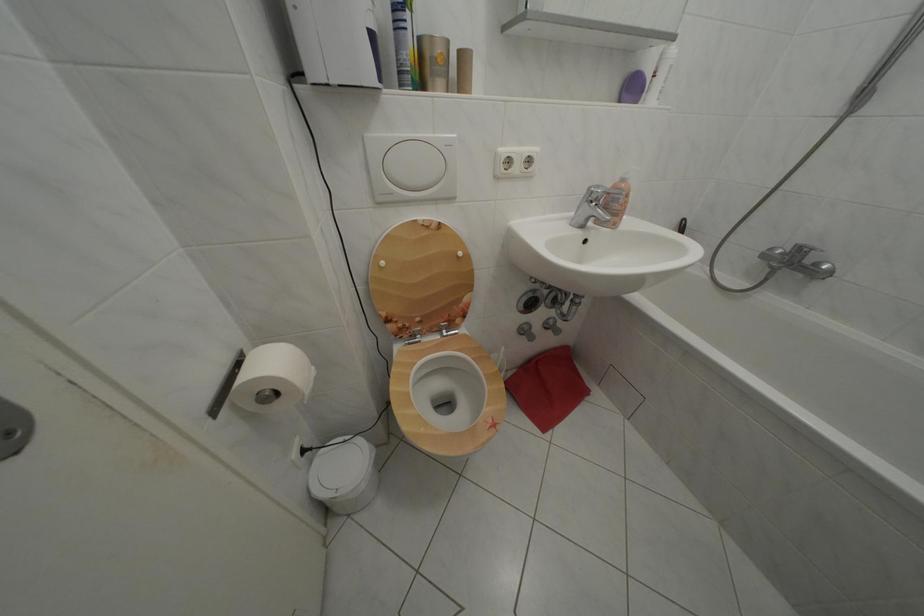
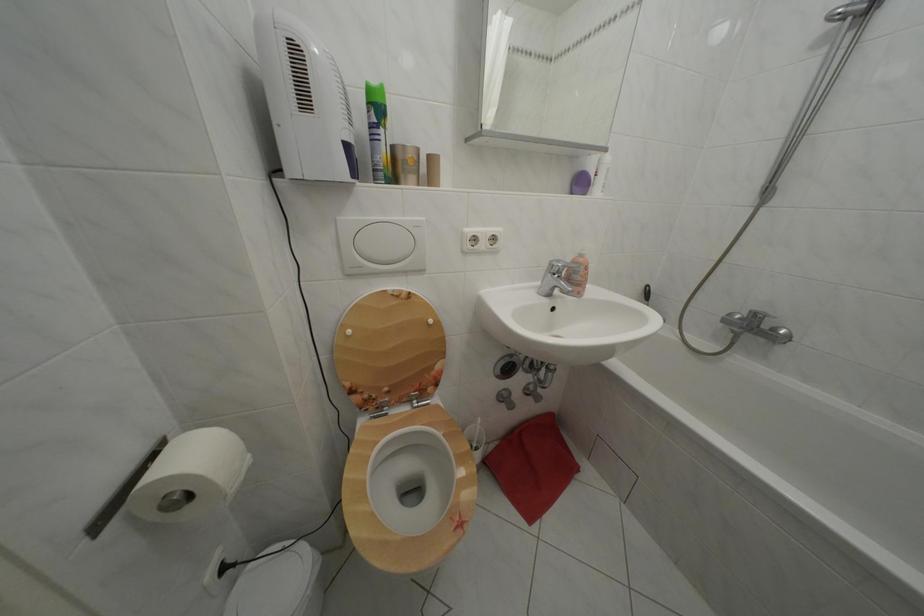
Locate, in the second image, the point that corresponds to [392,269] in the first image.

(358, 338)